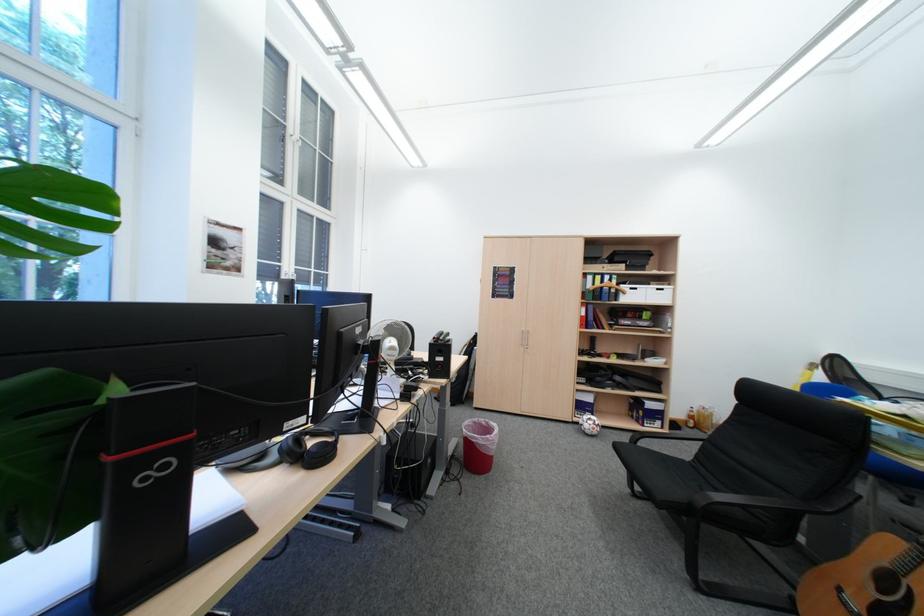
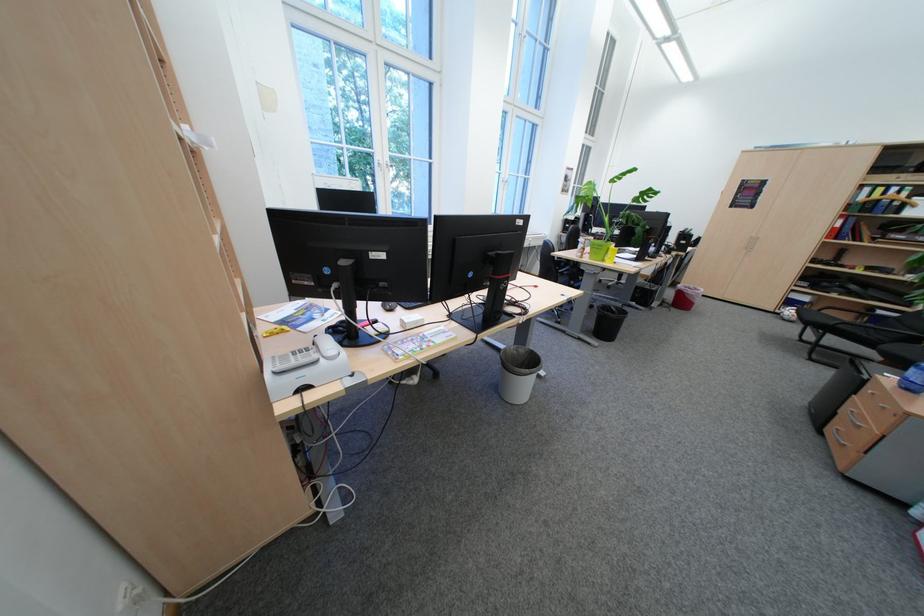
Locate, in the second image, the point that corresponds to (610,278) in the first image.

(893, 190)